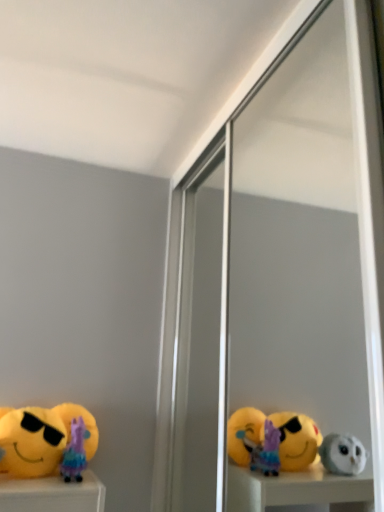
Question: In terms of height, does yellow plush toy at lower left, which ranks as the 1th toy in left-to-right order, look taller or shorter compared to transparent glass screen door at center?

Choices:
 (A) tall
 (B) short

Answer: (B)

Question: In terms of size, does yellow plush toy at lower left, acting as the second toy starting from the right, appear bigger or smaller than transparent glass screen door at center?

Choices:
 (A) big
 (B) small

Answer: (B)

Question: Which of these objects is positioned closest to the transparent glass screen door at center?

Choices:
 (A) purple fabric doll at lower left, which is counted as the 1th toy, starting from the right
 (B) yellow plush toy at lower left, acting as the second toy starting from the right

Answer: (B)

Question: Considering the real-world distances, which object is farthest from the yellow plush toy at lower left, acting as the second toy starting from the right?

Choices:
 (A) purple fabric doll at lower left, positioned as the second toy in left-to-right order
 (B) transparent glass screen door at center

Answer: (B)